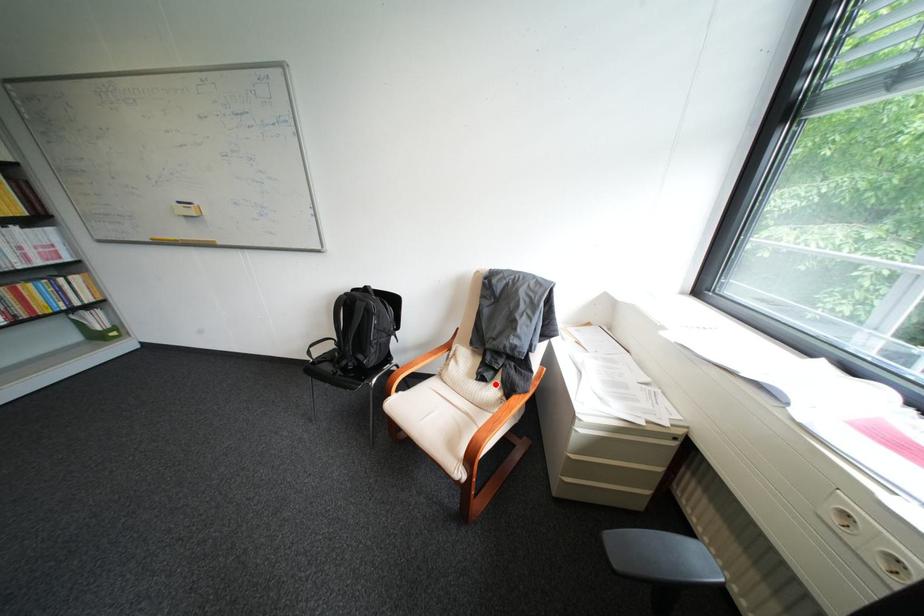
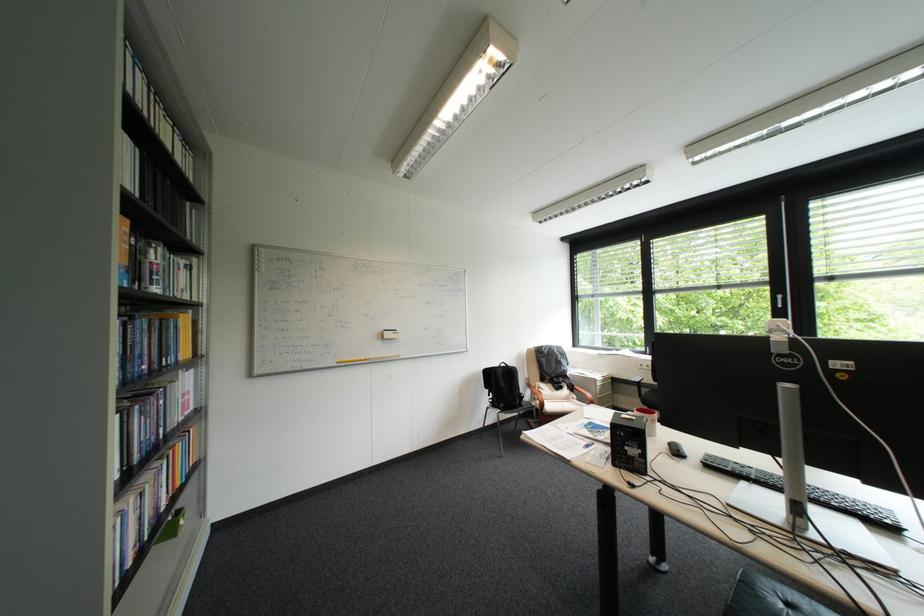
Question: I am providing you with two images of the same scene from different viewpoints. A red point is marked on the first image. Can you still see the location of the red point in image 2?

Choices:
 (A) Yes
 (B) No

Answer: (A)